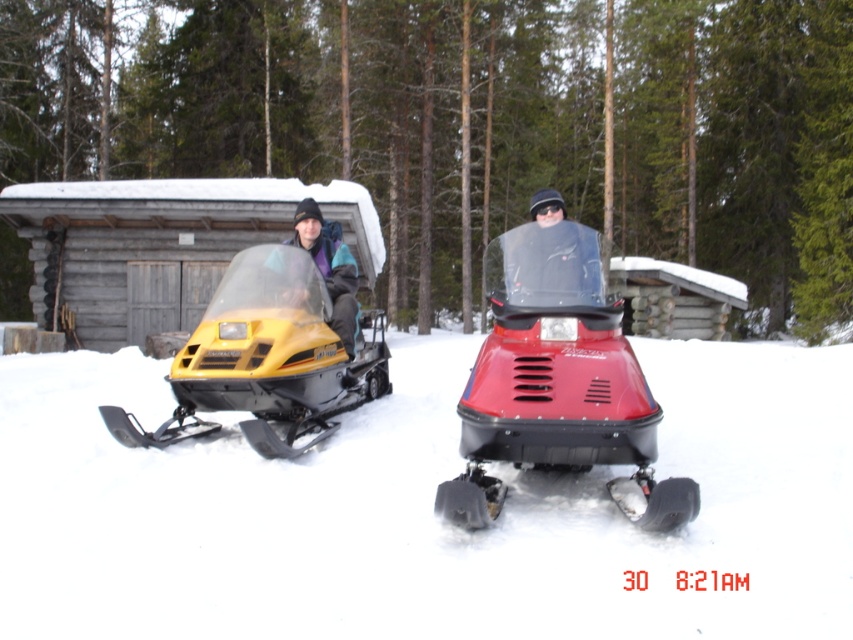
Question: Which of the following is the farthest from the observer?

Choices:
 (A) (582, 460)
 (B) (595, 296)
 (C) (788, 588)
 (D) (351, 353)

Answer: (D)

Question: Can you confirm if shiny red plastic snowmobile at center is positioned below yellow matte snowmobile at left?

Choices:
 (A) yes
 (B) no

Answer: (A)

Question: Which of the following is the closest to the observer?

Choices:
 (A) pos(167,372)
 (B) pos(318,227)
 (C) pos(532,241)
 (D) pos(427,516)

Answer: (D)

Question: Observing the image, what is the correct spatial positioning of matte black jacket at center in reference to matte yellow snowmobile at left?

Choices:
 (A) below
 (B) above

Answer: (B)

Question: Which object is farther from the camera taking this photo?

Choices:
 (A) matte yellow snowmobile at left
 (B) shiny red plastic snowmobile at center
 (C) matte black jacket at center
 (D) yellow matte snowmobile at left

Answer: (A)

Question: Is yellow matte snowmobile at left bigger than matte yellow snowmobile at left?

Choices:
 (A) no
 (B) yes

Answer: (B)